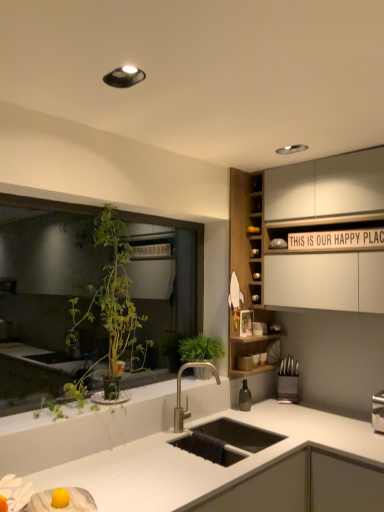
Question: Are white matte countertop at center and green leafy plant at left far apart?

Choices:
 (A) no
 (B) yes

Answer: (A)

Question: Can you confirm if white matte countertop at center is smaller than green leafy plant at left?

Choices:
 (A) yes
 (B) no

Answer: (B)

Question: Can you confirm if white matte countertop at center is shorter than green leafy plant at left?

Choices:
 (A) no
 (B) yes

Answer: (B)

Question: From the image's perspective, does white matte countertop at center appear higher than green leafy plant at left?

Choices:
 (A) yes
 (B) no

Answer: (B)

Question: Is green leafy plant at left completely or partially inside white matte countertop at center?

Choices:
 (A) no
 (B) yes

Answer: (A)

Question: Can you confirm if white matte countertop at center is taller than green leafy plant at left?

Choices:
 (A) no
 (B) yes

Answer: (A)

Question: From a real-world perspective, is satin nickel faucet at center positioned over green leafy plant at left based on gravity?

Choices:
 (A) no
 (B) yes

Answer: (A)

Question: Does satin nickel faucet at center have a lesser height compared to green leafy plant at left?

Choices:
 (A) yes
 (B) no

Answer: (A)

Question: From the image's perspective, is satin nickel faucet at center above green leafy plant at left?

Choices:
 (A) no
 (B) yes

Answer: (A)

Question: Is satin nickel faucet at center far away from green leafy plant at left?

Choices:
 (A) yes
 (B) no

Answer: (B)

Question: From a real-world perspective, is satin nickel faucet at center below green leafy plant at left?

Choices:
 (A) no
 (B) yes

Answer: (B)

Question: Is satin nickel faucet at center behind green leafy plant at left?

Choices:
 (A) no
 (B) yes

Answer: (B)

Question: Can you see wooden cabinet at upper right touching black plastic knife block at right?

Choices:
 (A) yes
 (B) no

Answer: (B)